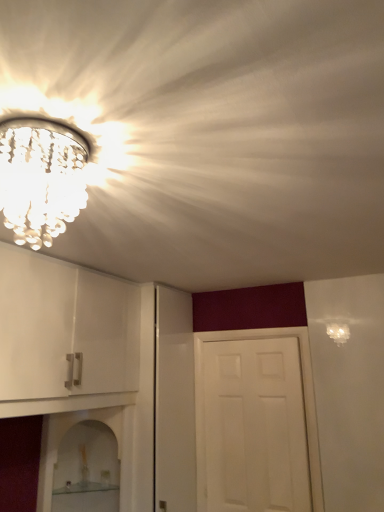
Question: Is clear glass shelf at lower left, the 1th shelf in the bottom-to-top sequence, facing away from clear crystal chandelier at upper left?

Choices:
 (A) yes
 (B) no

Answer: (B)

Question: Can you confirm if clear glass shelf at lower left, marked as the second shelf in a top-to-bottom arrangement, is wider than clear crystal chandelier at upper left?

Choices:
 (A) no
 (B) yes

Answer: (B)

Question: Is clear glass shelf at lower left, marked as the second shelf in a top-to-bottom arrangement, positioned before clear crystal chandelier at upper left?

Choices:
 (A) no
 (B) yes

Answer: (A)

Question: Is clear glass shelf at lower left, the 1th shelf in the bottom-to-top sequence, facing towards clear crystal chandelier at upper left?

Choices:
 (A) no
 (B) yes

Answer: (A)

Question: Does clear glass shelf at lower left, the 1th shelf in the bottom-to-top sequence, have a greater height compared to clear crystal chandelier at upper left?

Choices:
 (A) yes
 (B) no

Answer: (B)

Question: Does clear glass shelf at lower left, the 1th shelf in the bottom-to-top sequence, have a larger size compared to clear crystal chandelier at upper left?

Choices:
 (A) no
 (B) yes

Answer: (A)

Question: Considering the relative positions of white matte door at center and clear glass shelf at lower left, marked as the second shelf in a top-to-bottom arrangement, in the image provided, is white matte door at center to the right of clear glass shelf at lower left, marked as the second shelf in a top-to-bottom arrangement, from the viewer's perspective?

Choices:
 (A) yes
 (B) no

Answer: (A)

Question: Can you confirm if white matte door at center is wider than clear glass shelf at lower left, marked as the second shelf in a top-to-bottom arrangement?

Choices:
 (A) yes
 (B) no

Answer: (B)

Question: Can you confirm if white matte door at center is shorter than clear glass shelf at lower left, the 1th shelf in the bottom-to-top sequence?

Choices:
 (A) yes
 (B) no

Answer: (B)

Question: From a real-world perspective, is white matte door at center physically below clear glass shelf at lower left, the 1th shelf in the bottom-to-top sequence?

Choices:
 (A) yes
 (B) no

Answer: (B)

Question: Are white matte door at center and clear glass shelf at lower left, marked as the second shelf in a top-to-bottom arrangement, beside each other?

Choices:
 (A) yes
 (B) no

Answer: (B)

Question: From the image's perspective, is white matte door at center under clear glass shelf at lower left, marked as the second shelf in a top-to-bottom arrangement?

Choices:
 (A) no
 (B) yes

Answer: (A)

Question: Can you confirm if clear crystal chandelier at upper left is bigger than clear glass shelf at lower center, the 1th shelf positioned from the top?

Choices:
 (A) no
 (B) yes

Answer: (A)